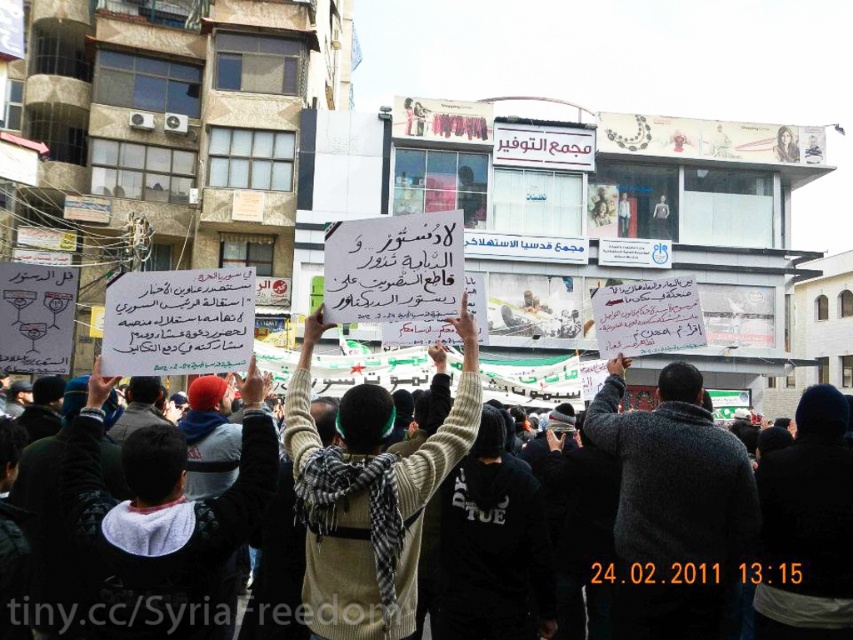
Does white paper sign at center have a greater width compared to white knitted sweater at center?

Yes.

The height and width of the screenshot is (640, 853). Describe the element at coordinates (163, 524) in the screenshot. I see `white paper sign at center` at that location.

Where is `white paper sign at center`? white paper sign at center is located at coordinates (163, 524).

Can you confirm if white paper sign at center is positioned above gray wool sweater at center?

Correct, white paper sign at center is located above gray wool sweater at center.

Which is more to the right, white paper sign at center or gray wool sweater at center?

gray wool sweater at center

Locate an element on the screen. white paper sign at center is located at coordinates (163, 524).

Is gray wool sweater at center further to camera compared to white knitted sweater at center?

Yes, it is.

Which is more to the left, gray wool sweater at center or white knitted sweater at center?

From the viewer's perspective, white knitted sweater at center appears more on the left side.

Find the location of a particular element. gray wool sweater at center is located at coordinates (674, 508).